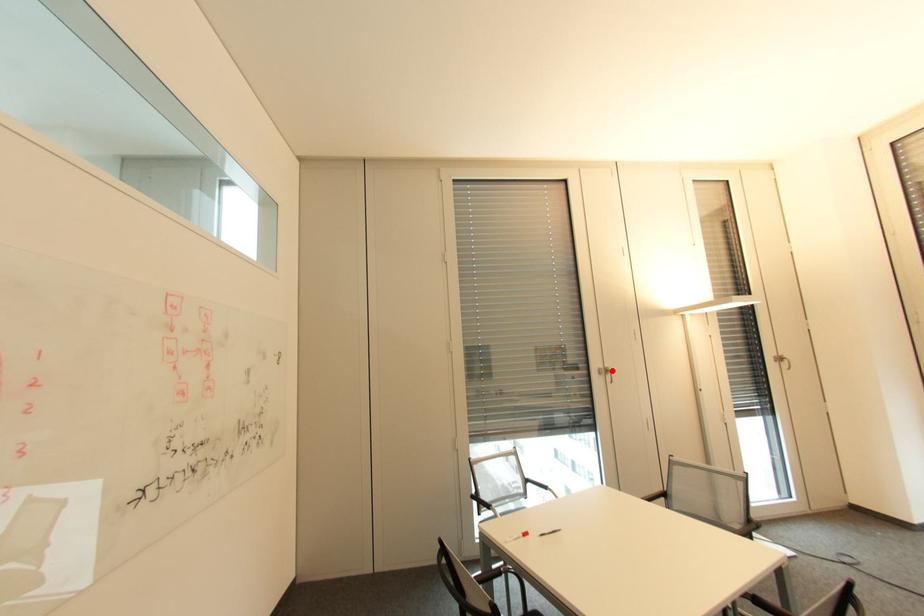
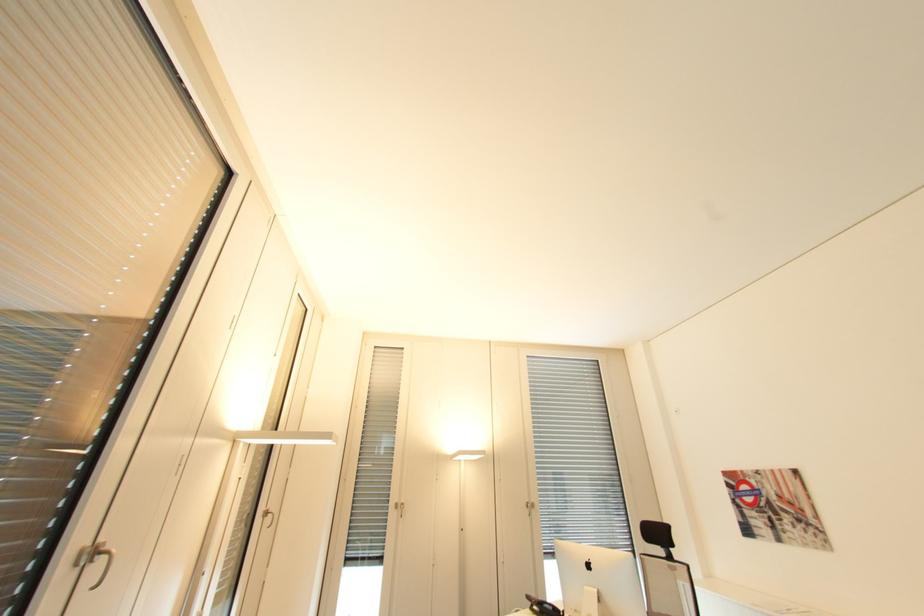
Where in the second image is the point corresponding to the highlighted location from the first image?

(99, 554)